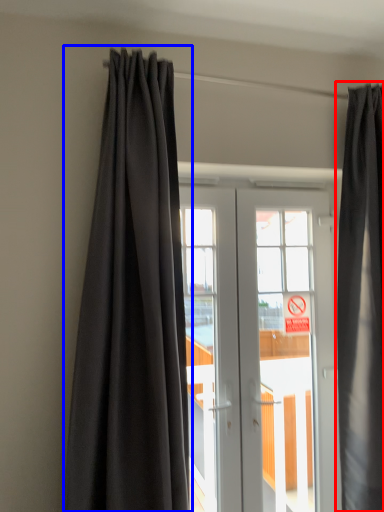
Question: Which object appears closest to the camera in this image, curtain (highlighted by a red box) or curtain (highlighted by a blue box)?

Choices:
 (A) curtain
 (B) curtain

Answer: (B)